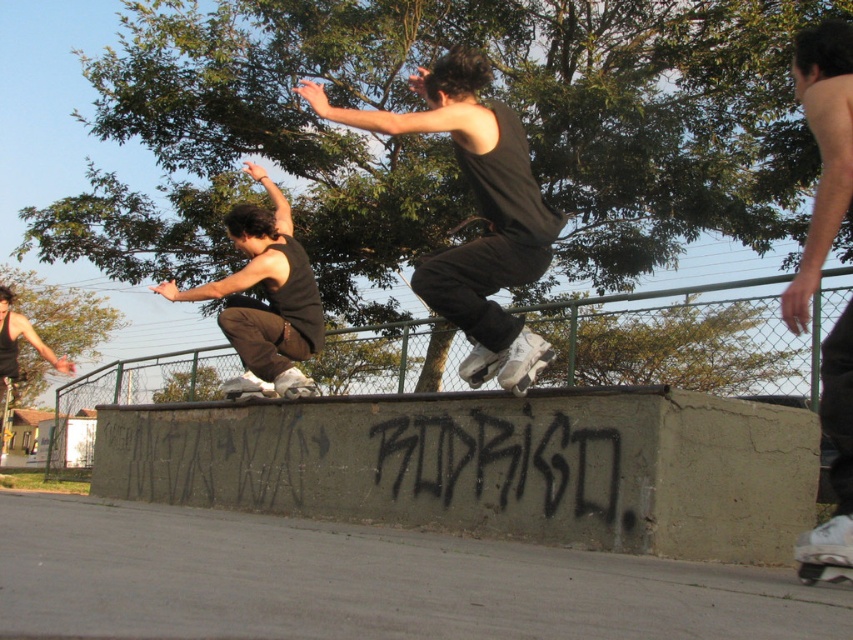
Question: Does black matte tank top at center appear under shiny black tank top at upper right?

Choices:
 (A) no
 (B) yes

Answer: (B)

Question: Is shiny black tank top at upper right smaller than matte black tank top at center?

Choices:
 (A) no
 (B) yes

Answer: (B)

Question: Estimate the real-world distances between objects in this image. Which object is closer to the shiny black tank top at upper right?

Choices:
 (A) matte black tank top at center
 (B) black matte tank top at center

Answer: (B)

Question: Which point is farther to the camera?

Choices:
 (A) matte black tank top at center
 (B) black matte tank top at center
 (C) shiny black tank top at upper right

Answer: (A)

Question: Which point appears closest to the camera in this image?

Choices:
 (A) (524, 198)
 (B) (846, 499)

Answer: (B)

Question: Is the position of black matte tank top at center more distant than that of matte black tank top at center?

Choices:
 (A) no
 (B) yes

Answer: (A)